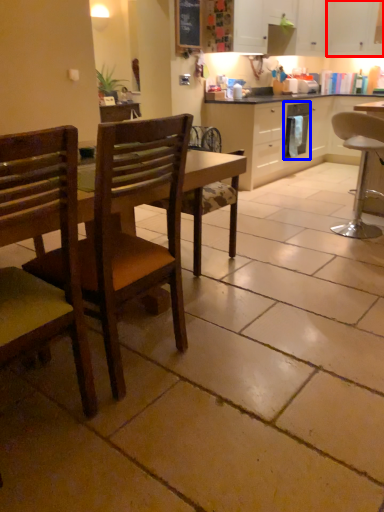
Question: Which point is further to the camera, cabinetry (highlighted by a red box) or dish washer (highlighted by a blue box)?

Choices:
 (A) cabinetry
 (B) dish washer

Answer: (A)